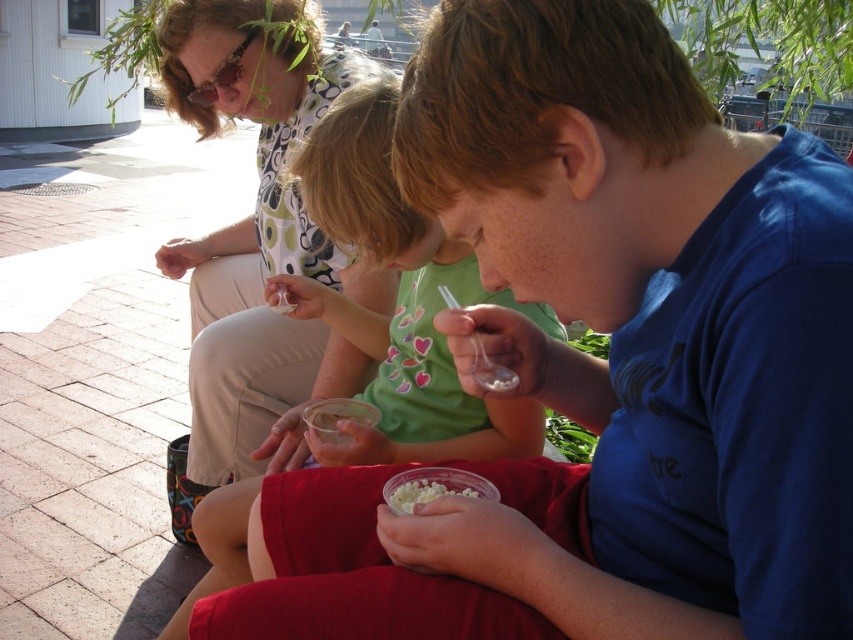
Question: Based on their relative distances, which object is farther from the green matte shirt at center?

Choices:
 (A) matte floral shirt at upper center
 (B) white creamy popcorn at lower center

Answer: (B)

Question: Does green matte shirt at center have a lesser width compared to white creamy popcorn at lower center?

Choices:
 (A) yes
 (B) no

Answer: (B)

Question: Does green matte shirt at center have a larger size compared to white creamy popcorn at lower center?

Choices:
 (A) no
 (B) yes

Answer: (B)

Question: Is green matte shirt at center bigger than white creamy popcorn at lower center?

Choices:
 (A) yes
 (B) no

Answer: (A)

Question: Which point is closer to the camera taking this photo?

Choices:
 (A) (361, 184)
 (B) (399, 493)

Answer: (B)

Question: Which point is farther to the camera?

Choices:
 (A) green matte shirt at center
 (B) white creamy popcorn at lower center
 (C) matte floral shirt at upper center

Answer: (C)